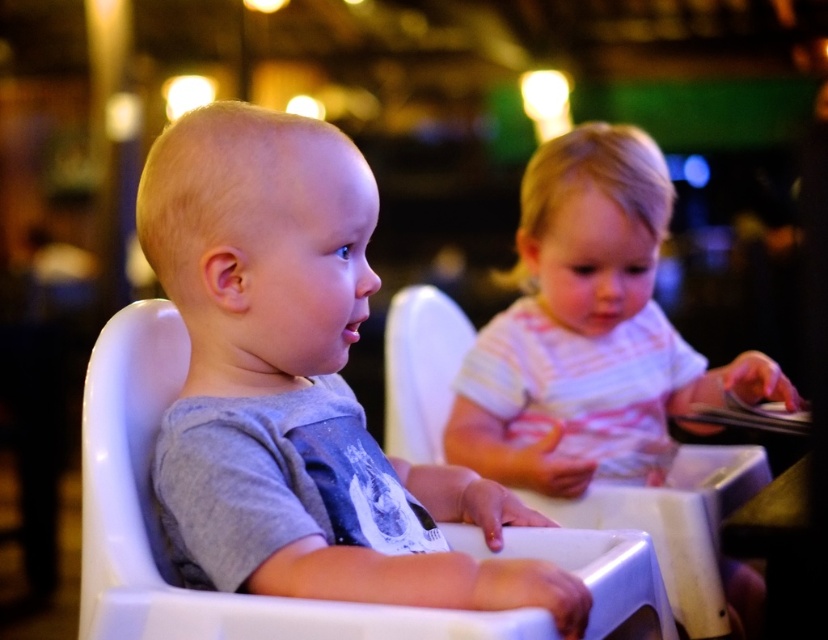
Who is taller, gray matte shirt at left or striped cotton shirt at right?

striped cotton shirt at right

Find the location of a particular element. Image resolution: width=828 pixels, height=640 pixels. gray matte shirt at left is located at coordinates (258, 250).